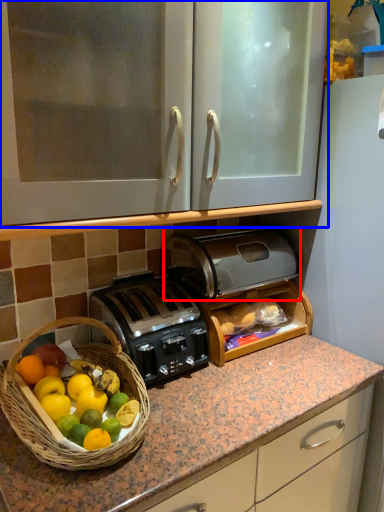
Question: Which point is further to the camera, toaster (highlighted by a red box) or cabinetry (highlighted by a blue box)?

Choices:
 (A) toaster
 (B) cabinetry

Answer: (A)